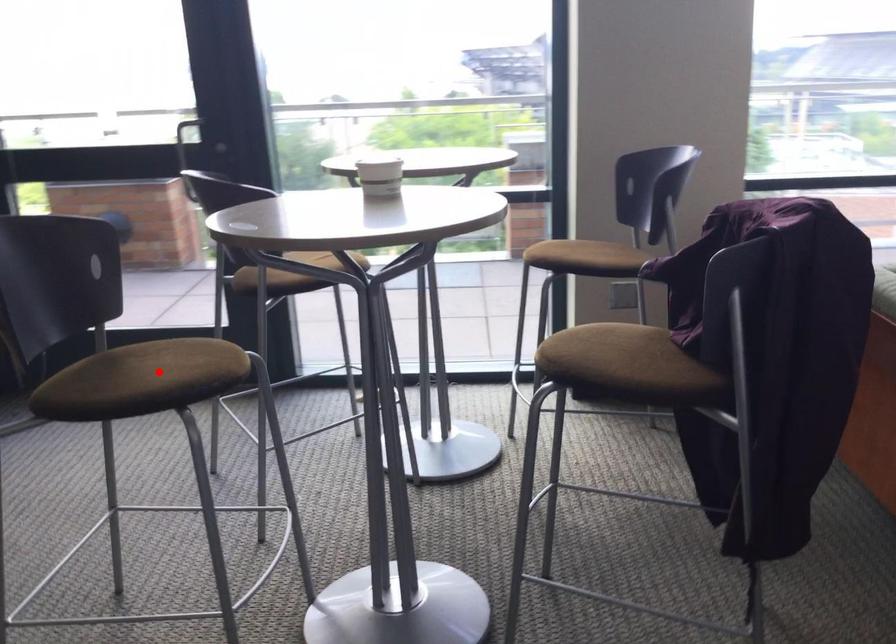
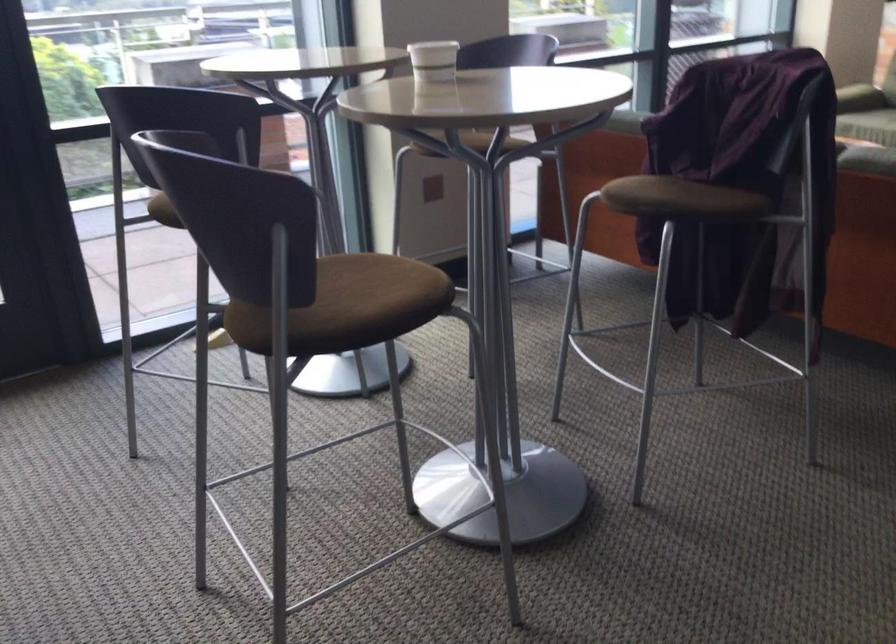
Question: I am providing you with two images of the same scene from different viewpoints. Image1 has a red point marked. In image2, the corresponding 3D location appears at what relative position? Reply with the corresponding letter.

Choices:
 (A) Closer
 (B) Farther

Answer: (A)